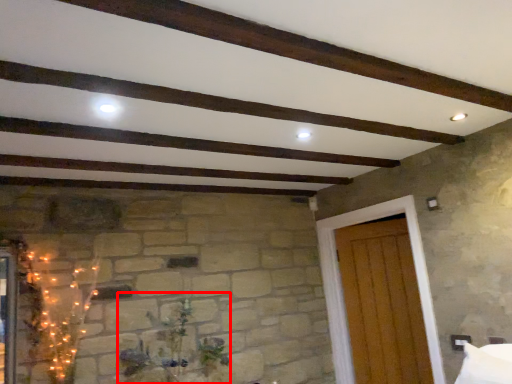
Question: In this image, where is plant (annotated by the red box) located relative to door?

Choices:
 (A) left
 (B) right

Answer: (A)